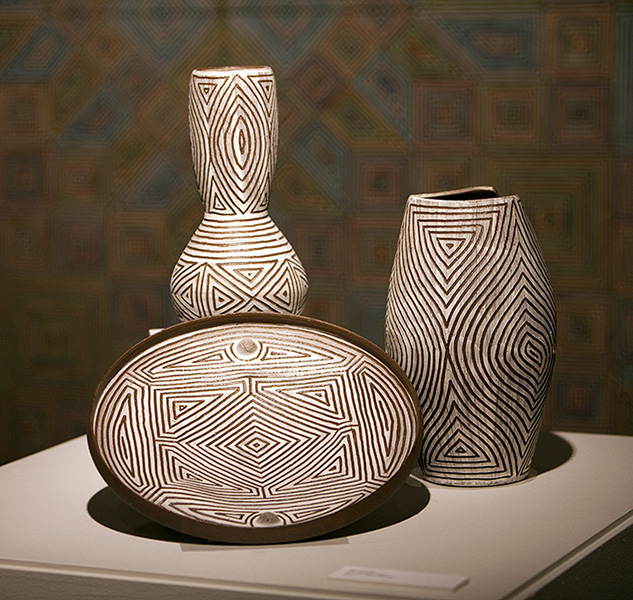
The width and height of the screenshot is (633, 600). I want to click on white square surface, so click(x=32, y=510).